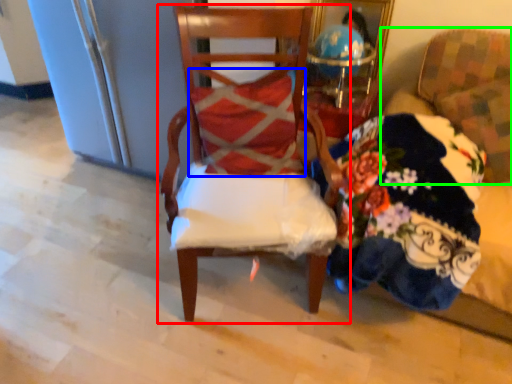
Question: Which is farther away from chair (highlighted by a red box)? pillow (highlighted by a blue box) or chair (highlighted by a green box)?

Choices:
 (A) pillow
 (B) chair

Answer: (B)